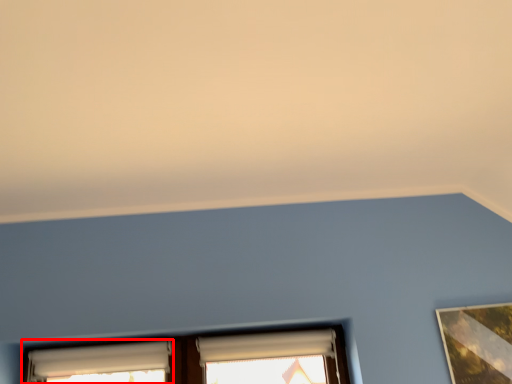
Question: From the image's perspective, what is the correct spatial relationship of window (annotated by the red box) in relation to window?

Choices:
 (A) above
 (B) below

Answer: (B)